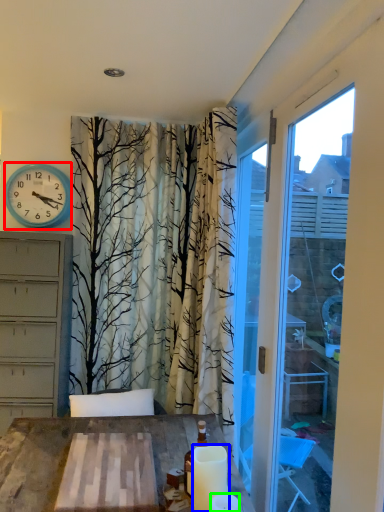
Question: Considering the real-world distances, which object is closest to wall clock (highlighted by a red box)? candle (highlighted by a blue box) or candle (highlighted by a green box).

Choices:
 (A) candle
 (B) candle

Answer: (A)